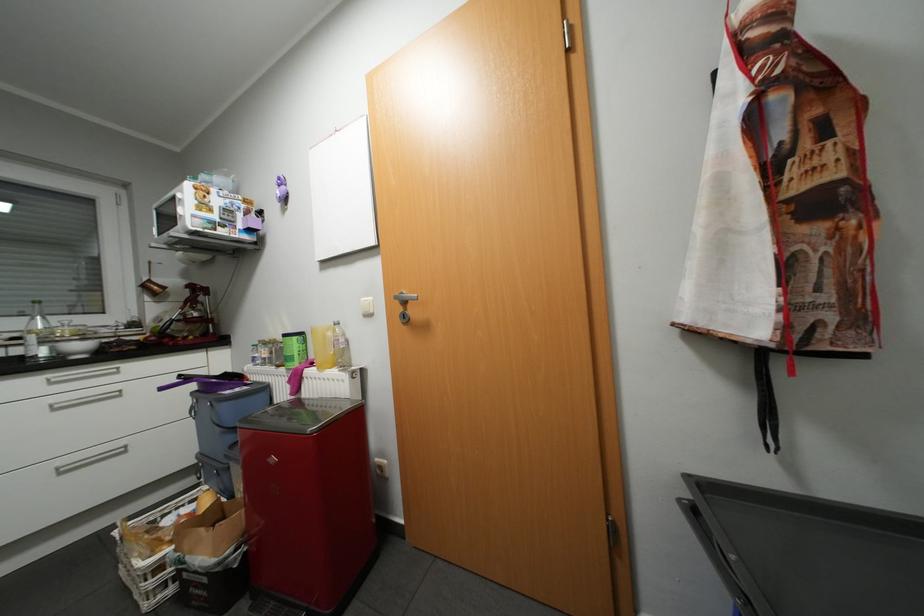
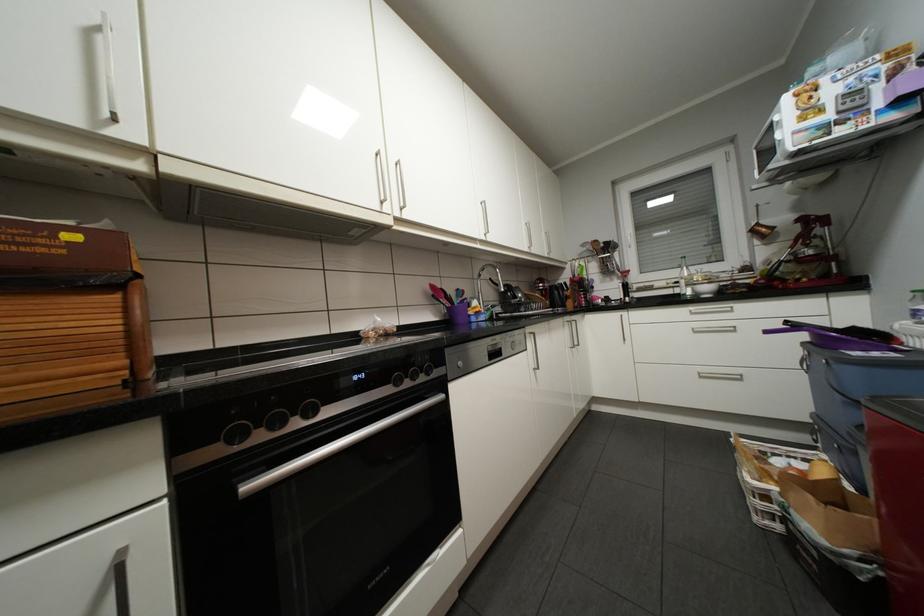
Locate, in the second image, the point that corresponds to point (64, 408) in the first image.

(703, 331)